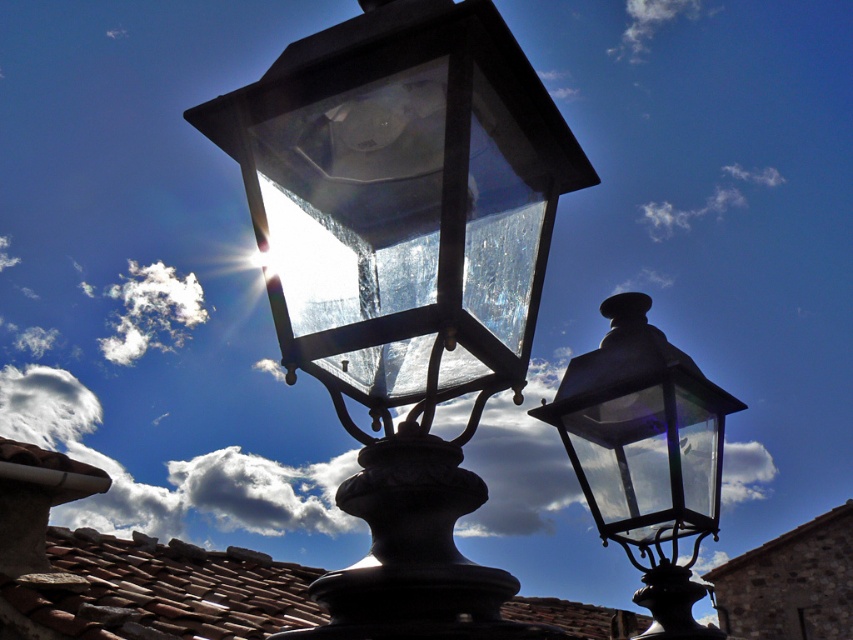
Question: Does matte glass lantern at center lie behind matte glass lamp at right?

Choices:
 (A) yes
 (B) no

Answer: (B)

Question: Can you confirm if matte glass lantern at center is wider than matte glass lamp at right?

Choices:
 (A) yes
 (B) no

Answer: (A)

Question: Among these objects, which one is farthest from the camera?

Choices:
 (A) matte glass lamp at right
 (B) matte glass lantern at center

Answer: (A)

Question: Is matte glass lantern at center behind matte glass lamp at right?

Choices:
 (A) no
 (B) yes

Answer: (A)

Question: Among these points, which one is farthest from the camera?

Choices:
 (A) (410, 458)
 (B) (640, 476)

Answer: (B)